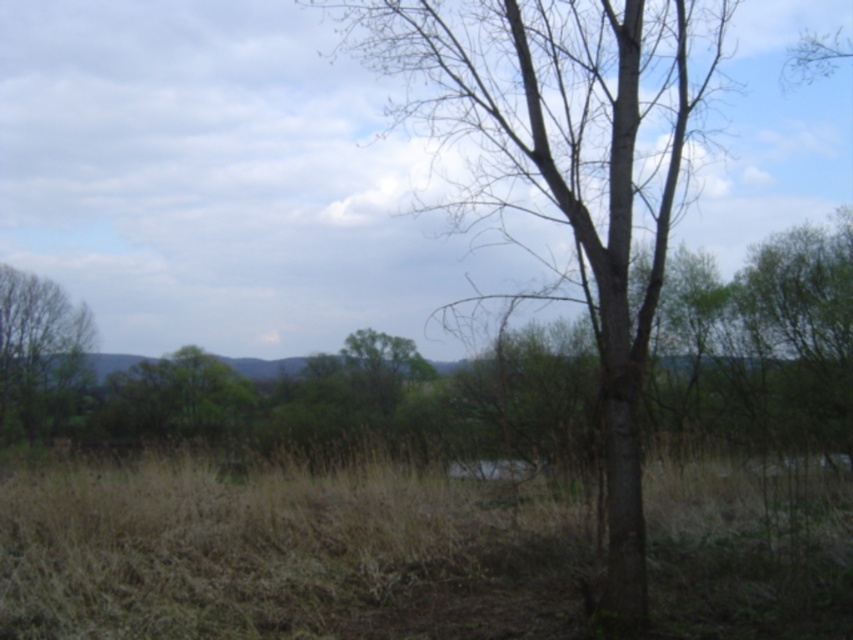
Question: Among these objects, which one is farthest from the camera?

Choices:
 (A) green leafy tree at left
 (B) smooth bark tree at center

Answer: (A)

Question: Where is brown dry grass at center located in relation to green leafy tree at left in the image?

Choices:
 (A) above
 (B) below

Answer: (B)

Question: Can you confirm if smooth bark tree at center is wider than green leafy tree at left?

Choices:
 (A) no
 (B) yes

Answer: (B)

Question: Estimate the real-world distances between objects in this image. Which object is closer to the smooth bark tree at center?

Choices:
 (A) brown dry grass at center
 (B) green leafy tree at left

Answer: (A)

Question: Is brown dry grass at center positioned in front of green leafy tree at left?

Choices:
 (A) no
 (B) yes

Answer: (B)

Question: Which object appears farthest from the camera in this image?

Choices:
 (A) green leafy tree at left
 (B) smooth bark tree at center

Answer: (A)